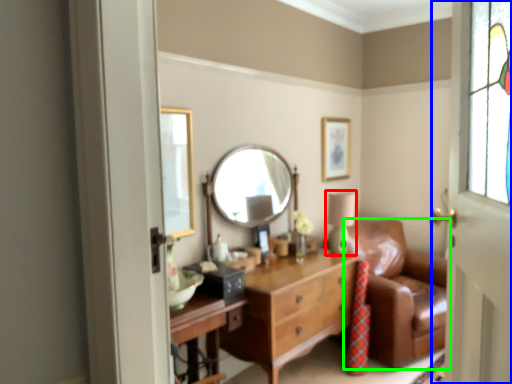
Question: Estimate the real-world distances between objects in this image. Which object is farther from table lamp (highlighted by a red box), door (highlighted by a blue box) or studio couch (highlighted by a green box)?

Choices:
 (A) door
 (B) studio couch

Answer: (A)